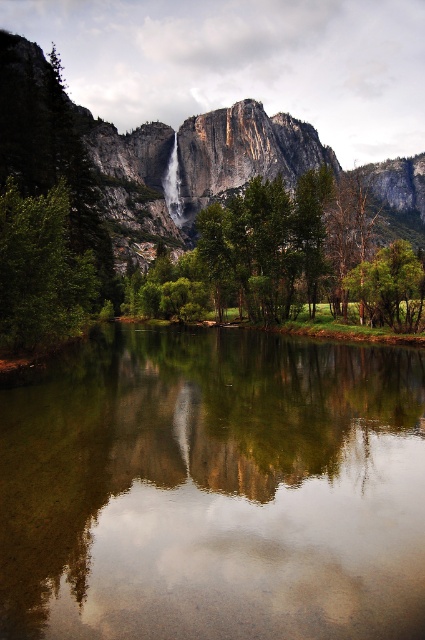
Question: Does rocky cliff at center have a greater width compared to green matte tree at lower right?

Choices:
 (A) yes
 (B) no

Answer: (A)

Question: Among these objects, which one is farthest from the camera?

Choices:
 (A) green matte tree at lower right
 (B) rocky cliff at center

Answer: (A)

Question: Which point appears closest to the camera in this image?

Choices:
 (A) (96, 467)
 (B) (170, 198)
 (C) (422, 300)

Answer: (A)

Question: Is green reflective water at center positioned in front of translucent glass waterfall at center?

Choices:
 (A) yes
 (B) no

Answer: (A)

Question: Which object is positioned farthest from the translucent glass waterfall at center?

Choices:
 (A) green matte tree at left
 (B) rocky cliff at center
 (C) green matte tree at lower right
 (D) green reflective water at center

Answer: (D)

Question: Is rocky cliff at center to the right of translucent glass waterfall at center from the viewer's perspective?

Choices:
 (A) no
 (B) yes

Answer: (B)